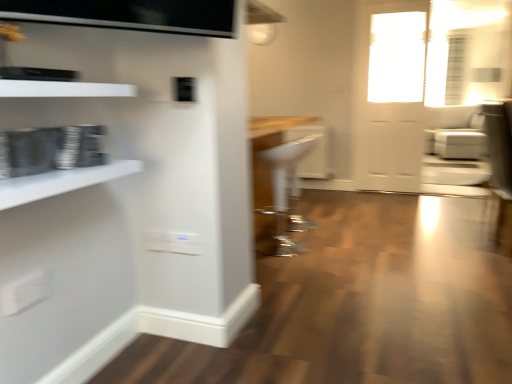
Question: Should I look upward or downward to see white plastic stool at center, positioned as the 2th armchair in top-to-bottom order?

Choices:
 (A) up
 (B) down

Answer: (B)

Question: Is clear glass door at upper right aimed at white glossy door at upper right?

Choices:
 (A) no
 (B) yes

Answer: (B)

Question: Is clear glass door at upper right directly adjacent to white glossy door at upper right?

Choices:
 (A) yes
 (B) no

Answer: (B)

Question: Can you confirm if clear glass door at upper right is wider than white glossy door at upper right?

Choices:
 (A) no
 (B) yes

Answer: (B)

Question: From the image's perspective, is clear glass door at upper right on white glossy door at upper right?

Choices:
 (A) yes
 (B) no

Answer: (A)

Question: Is clear glass door at upper right to the left of white glossy door at upper right from the viewer's perspective?

Choices:
 (A) no
 (B) yes

Answer: (A)

Question: From a real-world perspective, is clear glass door at upper right beneath white glossy door at upper right?

Choices:
 (A) no
 (B) yes

Answer: (A)

Question: Is the position of white plastic stool at center, positioned as the 2th armchair in top-to-bottom order, more distant than that of white glossy door at upper right?

Choices:
 (A) yes
 (B) no

Answer: (B)

Question: From a real-world perspective, is white plastic stool at center, marked as the second armchair in a back-to-front arrangement, positioned over white glossy door at upper right based on gravity?

Choices:
 (A) no
 (B) yes

Answer: (A)

Question: Is white plastic stool at center, the 2th armchair viewed from the right, next to white glossy door at upper right?

Choices:
 (A) no
 (B) yes

Answer: (A)

Question: From the image's perspective, would you say white plastic stool at center, the 2th armchair viewed from the right, is shown under white glossy door at upper right?

Choices:
 (A) no
 (B) yes

Answer: (B)

Question: Does white plastic stool at center, the 2th armchair viewed from the right, turn towards white glossy door at upper right?

Choices:
 (A) yes
 (B) no

Answer: (B)

Question: Are white plastic stool at center, marked as the first armchair in a bottom-to-top arrangement, and white glossy door at upper right far apart?

Choices:
 (A) no
 (B) yes

Answer: (B)

Question: Is white leather armchair at right, positioned as the second armchair in front-to-back order, smaller than white glossy shelf at upper left, arranged as the 2th shelf when ordered from the bottom?

Choices:
 (A) no
 (B) yes

Answer: (A)